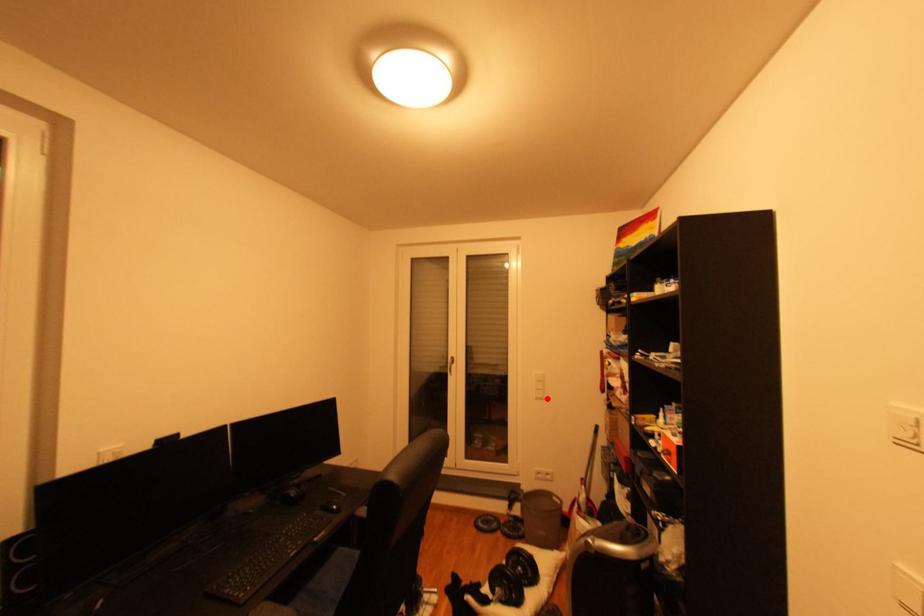
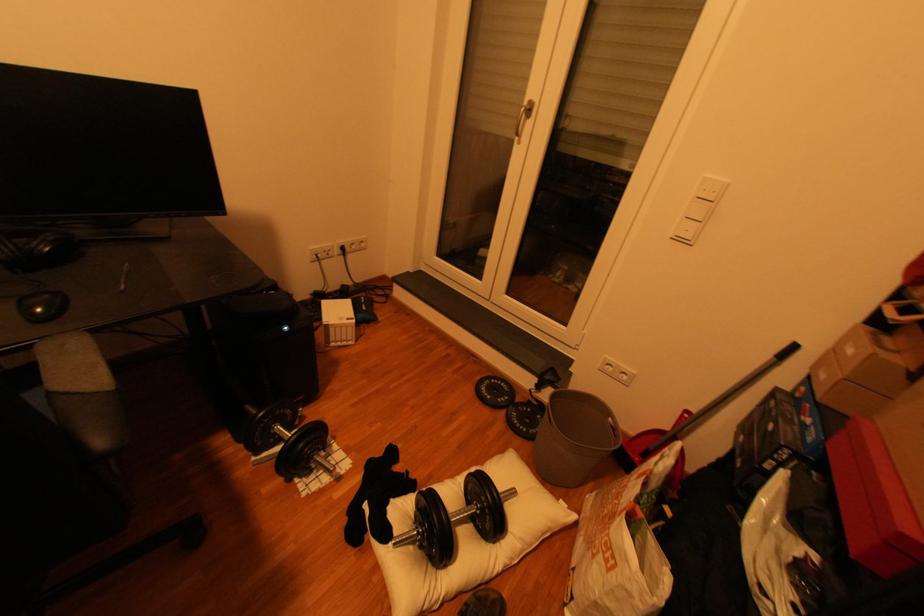
Question: I am providing you with two images of the same scene from different viewpoints. In image1, a red point is highlighted. Considering the same 3D point in image2, which of the following is correct?

Choices:
 (A) It is closer
 (B) It is farther

Answer: (A)